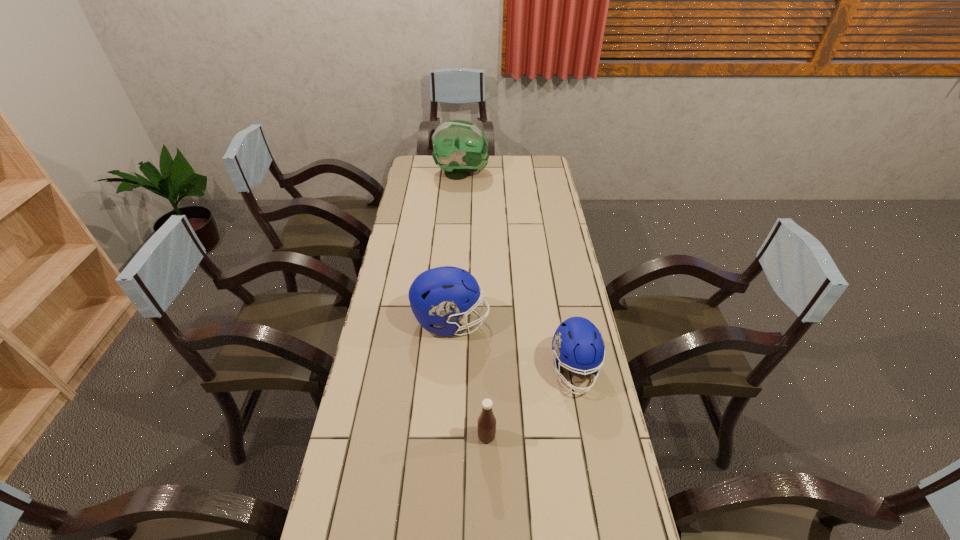
Where is `free space that is in between the nearest object and the second shortest football helmet`? The height and width of the screenshot is (540, 960). free space that is in between the nearest object and the second shortest football helmet is located at coordinates (468, 379).

Identify the location of free space between the nearest object and the second shortest football helmet. (468, 379).

The height and width of the screenshot is (540, 960). I want to click on free spot between the nearest object and the rightmost football helmet, so click(531, 403).

You are a GUI agent. You are given a task and a screenshot of the screen. Output one action in this format:
    pyautogui.click(x=<x>, y=<y>)
    Task: Click on the free space between the tallest football helmet and the rightmost football helmet
    The image size is (960, 540).
    Given the screenshot: What is the action you would take?
    pyautogui.click(x=517, y=272)

Where is `free space between the Tabasco sauce and the shortest football helmet`? free space between the Tabasco sauce and the shortest football helmet is located at coordinates (531, 403).

Find the location of `unoccupied position between the second shortest football helmet and the nearest object`. unoccupied position between the second shortest football helmet and the nearest object is located at coordinates (468, 379).

Identify the location of object that can be found as the second closest to the second tallest football helmet. Image resolution: width=960 pixels, height=540 pixels. (486, 423).

Point out which object is positioned as the second nearest to the Tabasco sauce. Please provide its 2D coordinates. Your answer should be formatted as a tuple, i.e. [(x, y)], where the tuple contains the x and y coordinates of a point satisfying the conditions above.

[(439, 296)]

This screenshot has width=960, height=540. Identify the location of football helmet that is the second closest one to the second tallest object. (460, 147).

Identify which football helmet is the second nearest to the rightmost object. Please provide its 2D coordinates. Your answer should be formatted as a tuple, i.e. [(x, y)], where the tuple contains the x and y coordinates of a point satisfying the conditions above.

[(460, 147)]